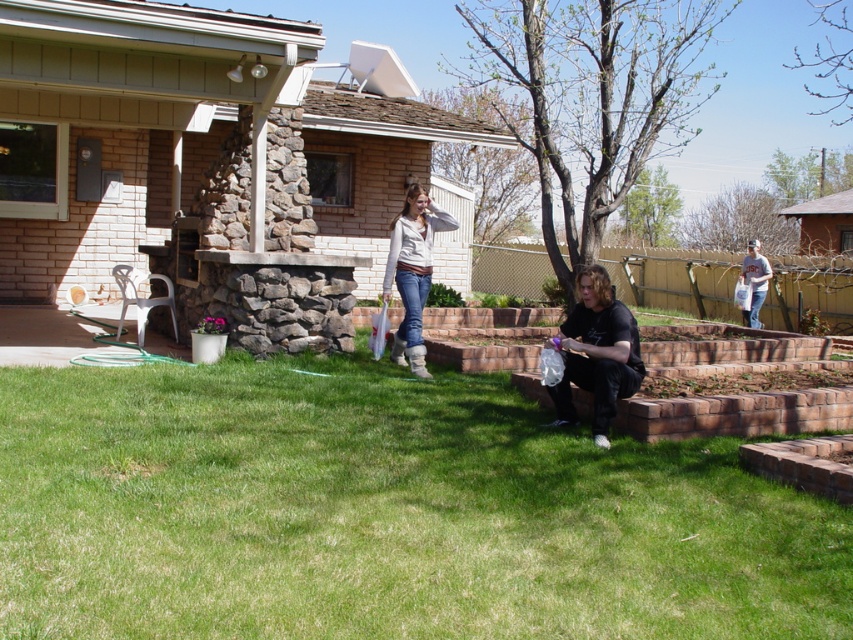
Question: Is the position of black matte shirt at center more distant than that of gray cotton t-shirt at right?

Choices:
 (A) yes
 (B) no

Answer: (B)

Question: Among these objects, which one is nearest to the camera?

Choices:
 (A) gray cotton t-shirt at right
 (B) matte white sweater at center
 (C) black matte shirt at center
 (D) green grass at lower center

Answer: (D)

Question: Does green grass at lower center have a greater width compared to black matte shirt at center?

Choices:
 (A) no
 (B) yes

Answer: (B)

Question: Does matte white sweater at center appear on the right side of gray cotton t-shirt at right?

Choices:
 (A) no
 (B) yes

Answer: (A)

Question: Among these points, which one is farthest from the camera?

Choices:
 (A) (97, 506)
 (B) (402, 216)
 (C) (751, 250)

Answer: (C)

Question: Among these points, which one is farthest from the camera?

Choices:
 (A) (630, 368)
 (B) (397, 262)

Answer: (B)